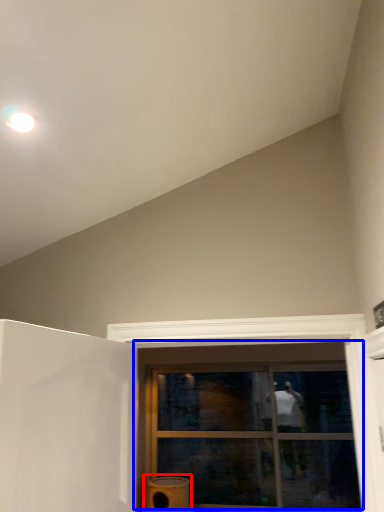
Question: Which point is closer to the camera, water heater (highlighted by a red box) or window (highlighted by a blue box)?

Choices:
 (A) water heater
 (B) window

Answer: (A)